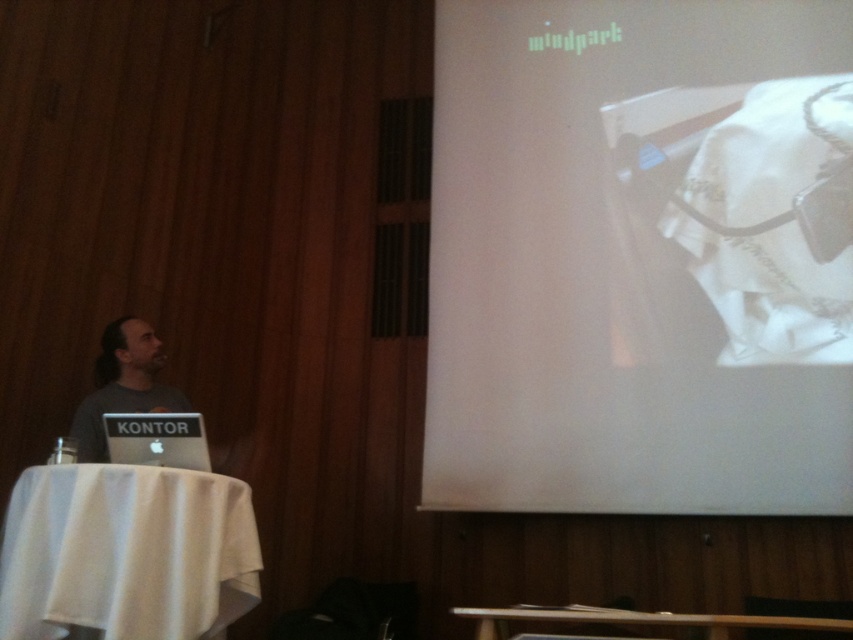
The image size is (853, 640). What do you see at coordinates (123, 385) in the screenshot? I see `gray matte laptop at left` at bounding box center [123, 385].

What do you see at coordinates (123, 385) in the screenshot?
I see `gray matte laptop at left` at bounding box center [123, 385].

Where is `gray matte laptop at left`? The width and height of the screenshot is (853, 640). gray matte laptop at left is located at coordinates (123, 385).

Is point (720, 356) positioned after point (114, 392)?

That is True.

Can you confirm if white glossy projector screen at upper right is wider than gray matte laptop at left?

Yes, white glossy projector screen at upper right is wider than gray matte laptop at left.

Measure the distance between white glossy projector screen at upper right and camera.

A distance of 10.60 feet exists between white glossy projector screen at upper right and camera.

The height and width of the screenshot is (640, 853). I want to click on white glossy projector screen at upper right, so click(x=641, y=257).

Which is below, white glossy projector screen at upper right or silver metallic laptop at lower left?

silver metallic laptop at lower left is lower down.

Looking at this image, can you confirm if white glossy projector screen at upper right is positioned above silver metallic laptop at lower left?

Yes.

Who is more distant from viewer, [741,476] or [193,449]?

Point [741,476]

This screenshot has width=853, height=640. In order to click on white glossy projector screen at upper right in this screenshot , I will do `click(641, 257)`.